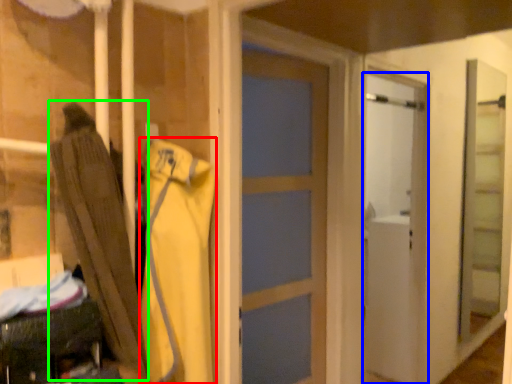
Question: Which is farther away from clothing (highlighted by a red box)? door (highlighted by a blue box) or umbrella (highlighted by a green box)?

Choices:
 (A) door
 (B) umbrella

Answer: (A)